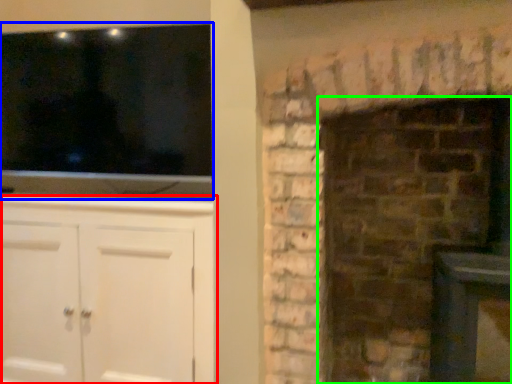
Question: Estimate the real-world distances between objects in this image. Which object is closer to cabinetry (highlighted by a red box), window (highlighted by a blue box) or fireplace (highlighted by a green box)?

Choices:
 (A) window
 (B) fireplace

Answer: (A)